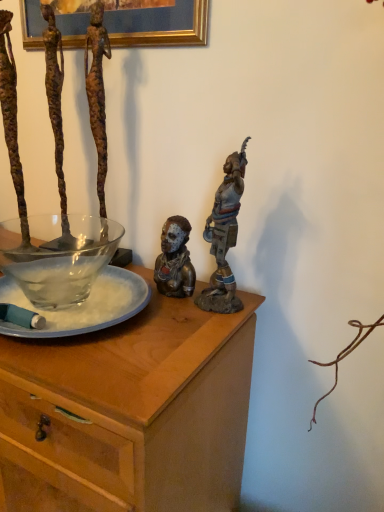
Question: From a real-world perspective, is bronze statue at upper right, which is counted as the 3th person, starting from the left, above or below rusty metal figure at upper left, acting as the first person starting from the left?

Choices:
 (A) above
 (B) below

Answer: (B)

Question: From the image's perspective, is bronze statue at upper right, the first person in the right-to-left sequence, above or below rusty metal figure at upper left, placed as the third person when sorted from right to left?

Choices:
 (A) below
 (B) above

Answer: (A)

Question: Estimate the real-world distances between objects in this image. Which object is closer to the rusty metal figure at upper left, acting as the first person starting from the left?

Choices:
 (A) transparent glass bowl at left
 (B) bronze statue at center, placed as the 2th person when sorted from left to right
 (C) wooden desk at center
 (D) bronze statue at upper right, the first person in the right-to-left sequence
 (E) clear glass plate at center

Answer: (A)

Question: Considering the real-world distances, which object is closest to the bronze statue at upper right, the first person in the right-to-left sequence?

Choices:
 (A) bronze statue at center, placed as the 2th person when sorted from left to right
 (B) transparent glass bowl at left
 (C) clear glass plate at center
 (D) wooden desk at center
 (E) rusty metal figure at upper left, acting as the first person starting from the left

Answer: (A)